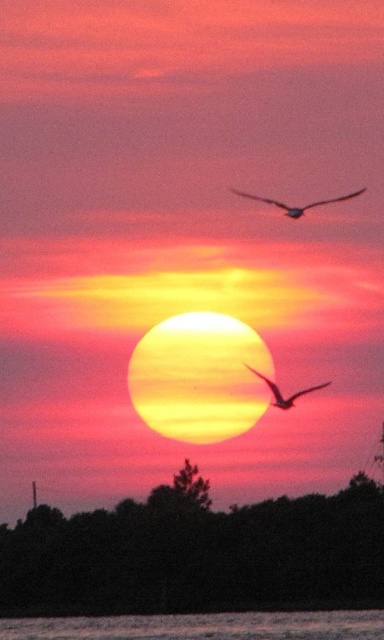
You are an artist painting this sunset scene. You want to ensure the smooth water at lower center and the silhouette feathered bird at upper center are proportionally accurate. Which object should you make smaller in your painting?

The smooth water at lower center occupies less space than the silhouette feathered bird at upper center, so you should make the smooth water at lower center smaller than the silhouette feathered bird at upper center in your painting.

You are standing at the edge of a forest and see the dark green leafy trees at lower center and the silhouette feathered bird at center. If you want to take a photo of both in the same frame, will you need to zoom in or zoom out?

The dark green leafy trees at lower center is 80.63 feet away from the silhouette feathered bird at center. To capture both in the same frame, you would need to zoom out to widen the field of view, allowing both distant objects to be included in the photo.

In the scene shown: You are standing on the shore looking at the sunset scene. You see the smooth water at lower center and the silhouette feathered bird at upper center. Which object appears nearer to you?

The smooth water at lower center appears nearer to you because it is closer to the viewer than the silhouette feathered bird at upper center.